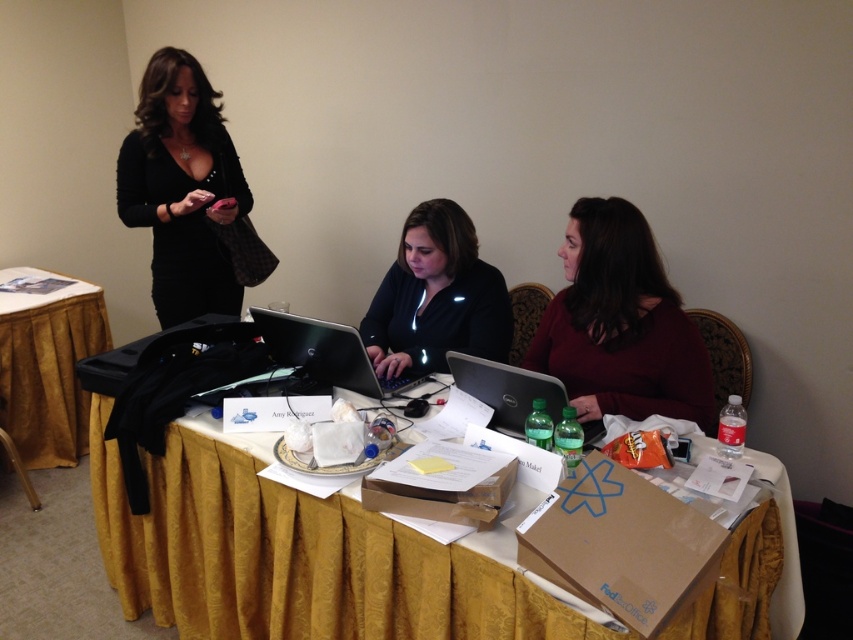
Question: Which point is farther to the camera?

Choices:
 (A) black matte laptop at center
 (B) glossy black laptop at center

Answer: (A)

Question: Does burgundy sweater at center have a greater width compared to gold fabric table at lower left?

Choices:
 (A) yes
 (B) no

Answer: (A)

Question: Which object appears closest to the camera in this image?

Choices:
 (A) gold fabric table at lower left
 (B) burgundy sweater at center
 (C) black matte laptop at center
 (D) glossy black laptop at center

Answer: (B)

Question: Which point is closer to the camera taking this photo?

Choices:
 (A) (730, 570)
 (B) (299, 328)
 (C) (392, 300)
 (D) (538, 355)

Answer: (A)

Question: Observing the image, what is the correct spatial positioning of burgundy sweater at center in reference to black plastic laptop at center?

Choices:
 (A) above
 (B) below

Answer: (A)

Question: In this image, where is yellow fabric tablecloth at center located relative to black plastic laptop at center?

Choices:
 (A) above
 (B) below

Answer: (B)